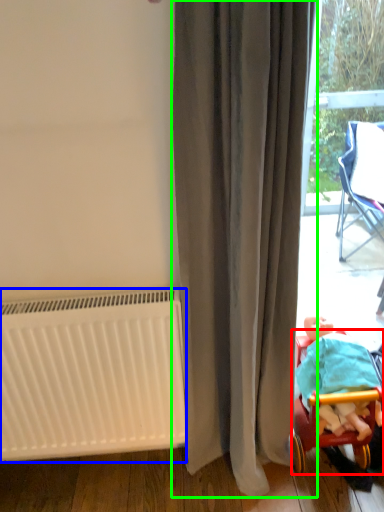
Question: Which is nearer to the furniture (highlighted by a red box)? radiator (highlighted by a blue box) or curtain (highlighted by a green box).

Choices:
 (A) radiator
 (B) curtain

Answer: (B)